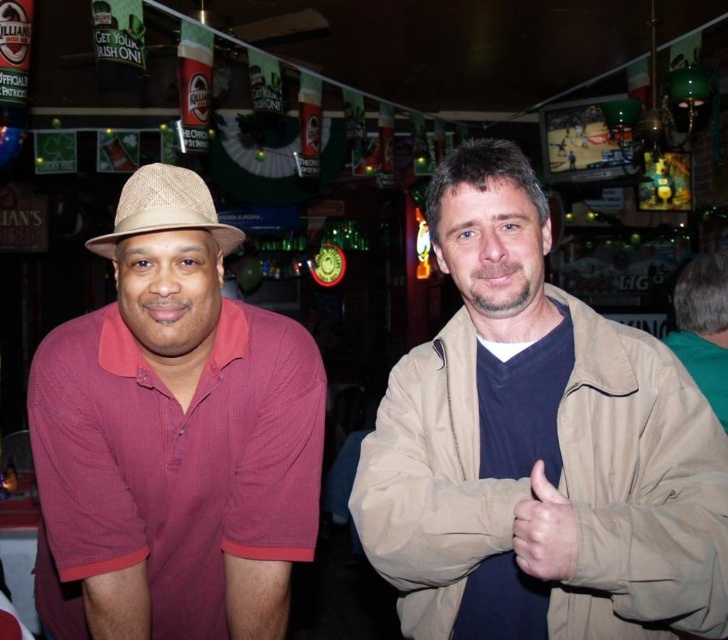
Does matte red shirt at left come in front of tan woven fedora at left?

Yes, it is.

Which of these two, matte red shirt at left or tan woven fedora at left, stands shorter?

Standing shorter between the two is tan woven fedora at left.

Image resolution: width=728 pixels, height=640 pixels. Identify the location of matte red shirt at left. (173, 438).

Image resolution: width=728 pixels, height=640 pixels. What are the coordinates of `matte red shirt at left` in the screenshot? It's located at coord(173,438).

Between tan fabric jacket at right and smooth beige hand at center, which one has more height?

tan fabric jacket at right

What do you see at coordinates (537, 444) in the screenshot?
I see `tan fabric jacket at right` at bounding box center [537, 444].

Does point (648, 520) lie in front of point (518, 557)?

No, (648, 520) is further to viewer.

Identify the location of tan fabric jacket at right. This screenshot has width=728, height=640. (537, 444).

Is tan woven fedora at left above smooth beige hand at center?

Correct, tan woven fedora at left is located above smooth beige hand at center.

Is tan woven fedora at left bigger than smooth beige hand at center?

Correct, tan woven fedora at left is larger in size than smooth beige hand at center.

Between point (202, 189) and point (571, 525), which one is positioned in front?

Positioned in front is point (571, 525).

I want to click on tan woven fedora at left, so click(x=165, y=209).